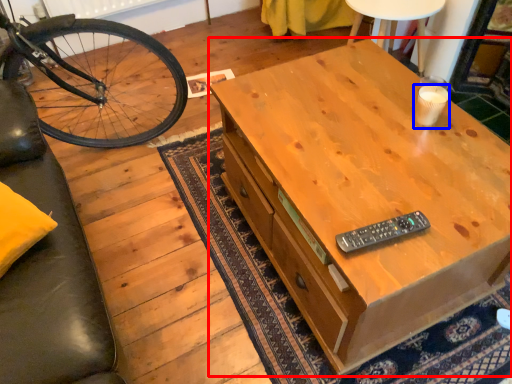
Question: Among these objects, which one is nearest to the camera, desk (highlighted by a red box) or coffee cup (highlighted by a blue box)?

Choices:
 (A) desk
 (B) coffee cup

Answer: (A)